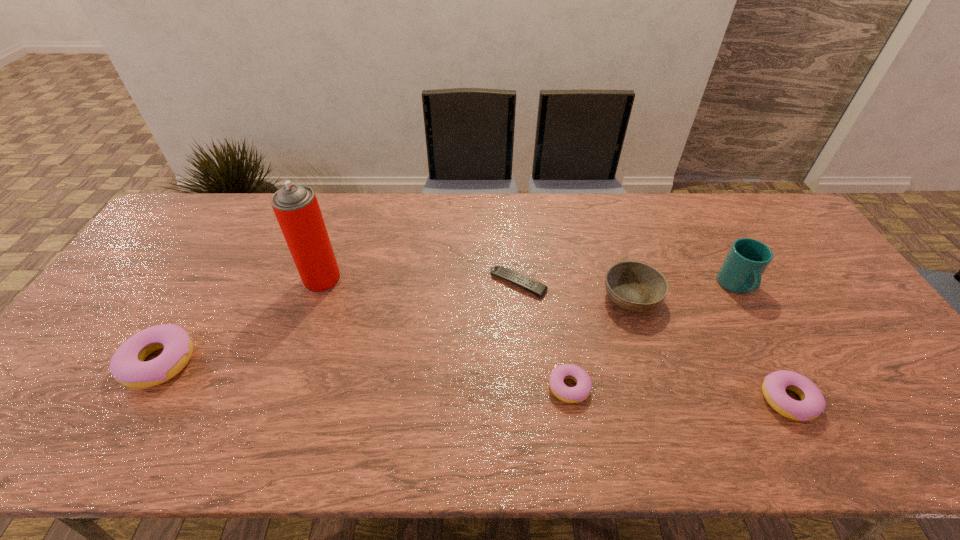
I want to click on free spot between the tallest doughnut and the aerosol can, so click(x=241, y=321).

Identify the location of free area in between the third object from right to left and the shortest object. (575, 291).

Where is `blank region between the bowl and the fifth tallest object`? blank region between the bowl and the fifth tallest object is located at coordinates 709,349.

Locate an element on the screen. The image size is (960, 540). the fourth closest object to the shortest doughnut is located at coordinates (741, 271).

Choose which object is the second nearest neighbor to the sixth tallest object. Please provide its 2D coordinates. Your answer should be formatted as a tuple, i.e. [(x, y)], where the tuple contains the x and y coordinates of a point satisfying the conditions above.

[(525, 282)]

Identify the location of the closest doughnut to the aerosol can. Image resolution: width=960 pixels, height=540 pixels. (127, 366).

Choose which doughnut is the third nearest neighbor to the aerosol can. Please provide its 2D coordinates. Your answer should be formatted as a tuple, i.e. [(x, y)], where the tuple contains the x and y coordinates of a point satisfying the conditions above.

[(812, 404)]

At what (x,y) coordinates should I click in order to perform the action: click on free location that satisfies the following two spatial constraints: 1. on the front side of the sixth tallest object; 2. on the right side of the tallest object. Please return your answer as a coordinate pair (x, y). This screenshot has width=960, height=540. Looking at the image, I should click on (285, 387).